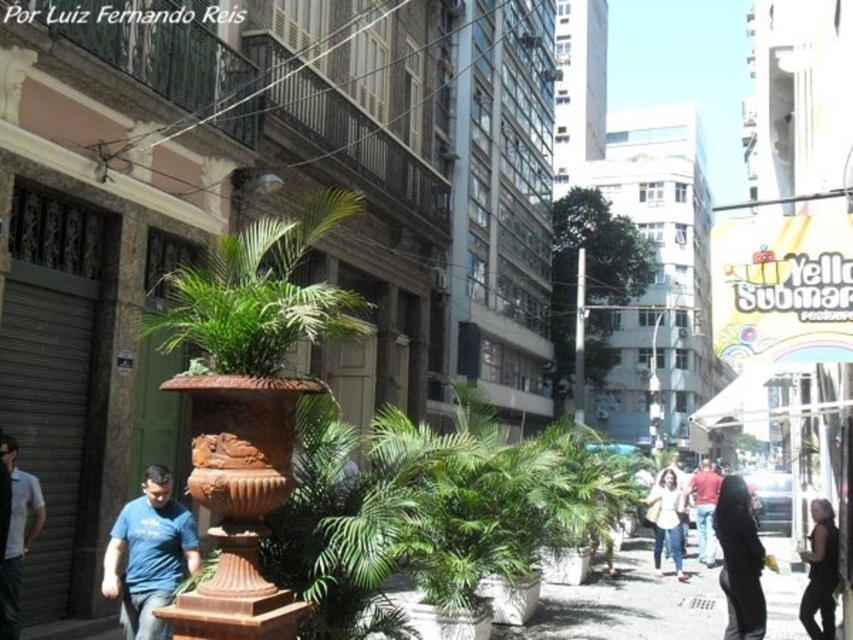
Question: Among these points, which one is nearest to the camera?

Choices:
 (A) pos(811,628)
 (B) pos(759,616)

Answer: (B)

Question: Which object is positioned closest to the brown terracotta pot at center?

Choices:
 (A) blue t-shirt at center
 (B) light blue shirt at lower left
 (C) matte red shirt at center
 (D) black leather jacket at lower right

Answer: (A)

Question: Where is black leather jacket at lower right located in relation to matte red shirt at center in the image?

Choices:
 (A) left
 (B) right

Answer: (A)

Question: Is black leather jacket at lower right in front of matte red shirt at center?

Choices:
 (A) no
 (B) yes

Answer: (B)

Question: Considering the relative positions of brown terracotta pot at center and dark gray fabric jacket at lower right in the image provided, where is brown terracotta pot at center located with respect to dark gray fabric jacket at lower right?

Choices:
 (A) below
 (B) above

Answer: (B)

Question: Which object is the farthest from the white cotton shirt at center?

Choices:
 (A) blue t-shirt at center
 (B) brown terracotta pot at center
 (C) matte red shirt at center

Answer: (A)